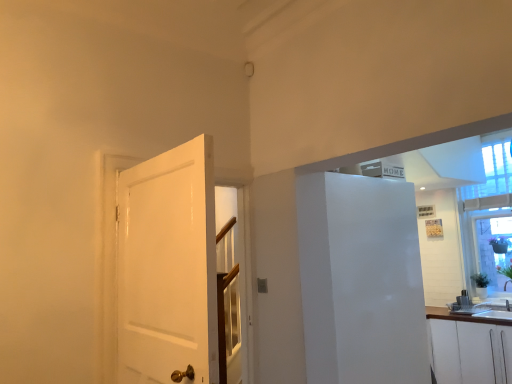
Question: Is white glossy door at left in front of or behind white matte cabinet at lower right in the image?

Choices:
 (A) behind
 (B) front

Answer: (B)

Question: Which is correct: white glossy door at left is inside white matte cabinet at lower right, or outside of it?

Choices:
 (A) inside
 (B) outside

Answer: (B)

Question: Which object is the closest to the white glossy door at left?

Choices:
 (A) white matte cabinet at lower right
 (B) white glossy refrigerator at right
 (C) transparent glass window at upper right

Answer: (B)

Question: Which of these objects is positioned closest to the white glossy refrigerator at right?

Choices:
 (A) white glossy door at left
 (B) transparent glass window at upper right
 (C) white matte cabinet at lower right

Answer: (A)